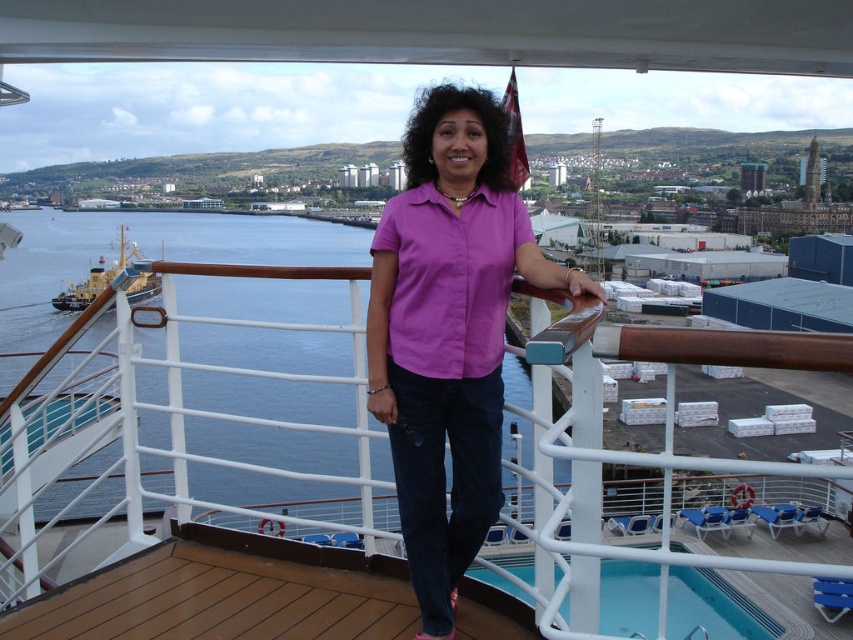
Question: Is matte pink shirt at center to the right of yellow painted steel ship at left from the viewer's perspective?

Choices:
 (A) yes
 (B) no

Answer: (A)

Question: Does matte pink shirt at center appear under yellow painted steel ship at left?

Choices:
 (A) yes
 (B) no

Answer: (A)

Question: Among these objects, which one is farthest from the camera?

Choices:
 (A) yellow painted steel ship at left
 (B) matte pink shirt at center

Answer: (A)

Question: Which point appears closest to the camera in this image?

Choices:
 (A) (453, 237)
 (B) (97, 269)

Answer: (A)

Question: Does matte pink shirt at center have a lesser width compared to yellow painted steel ship at left?

Choices:
 (A) no
 (B) yes

Answer: (B)

Question: Among these points, which one is farthest from the camera?

Choices:
 (A) (70, 308)
 (B) (428, 566)

Answer: (A)